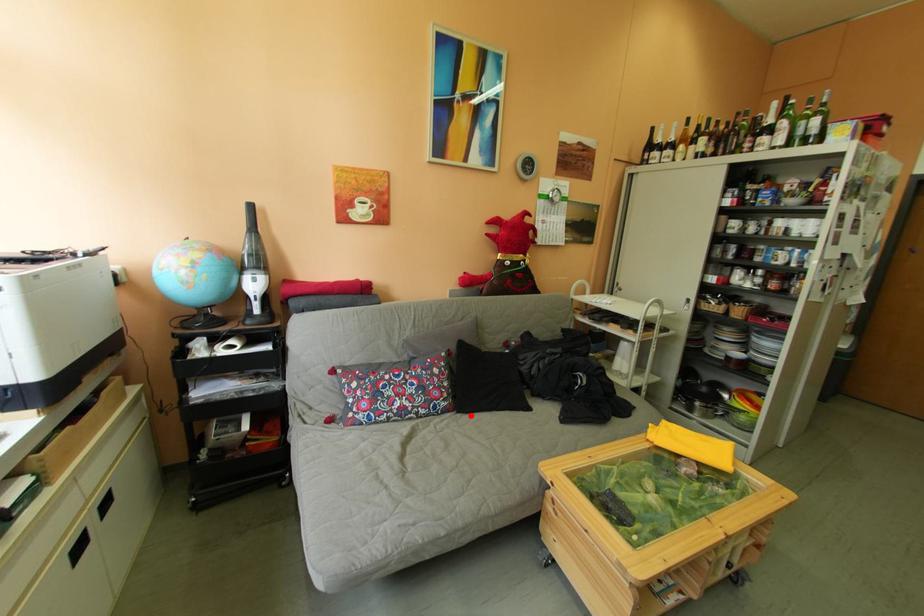
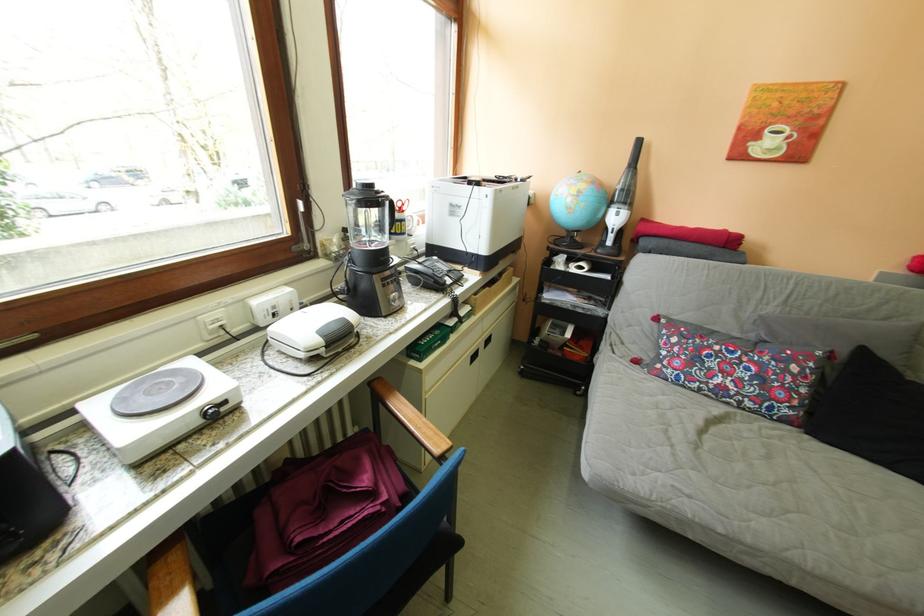
Question: A red point is marked in image1. In image2, is the corresponding 3D point closer to the camera or farther? Reply with the corresponding letter.

Choices:
 (A) The corresponding 3D point is closer.
 (B) The corresponding 3D point is farther.

Answer: (A)